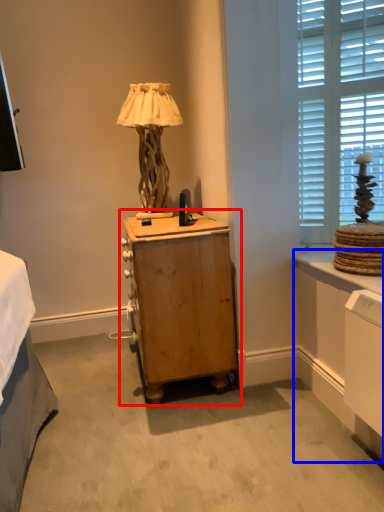
Question: Which object is closer to the camera taking this photo, nightstand (highlighted by a red box) or vanity (highlighted by a blue box)?

Choices:
 (A) nightstand
 (B) vanity

Answer: (B)